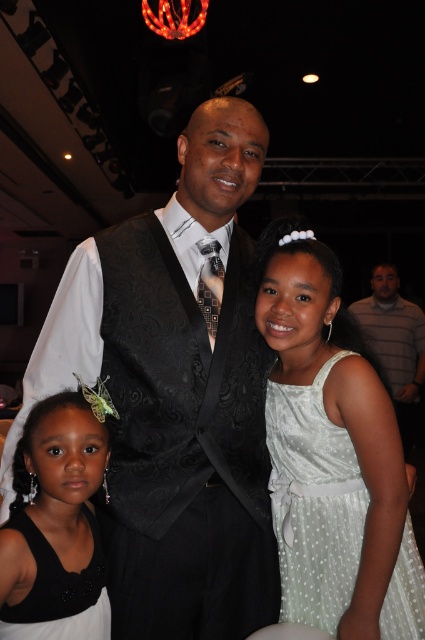
Between black satin dress at lower left and striped cotton shirt at upper right, which one is positioned higher?

black satin dress at lower left is higher up.

You are a GUI agent. You are given a task and a screenshot of the screen. Output one action in this format:
    pyautogui.click(x=<x>, y=<y>)
    Task: Click on the black satin dress at lower left
    This screenshot has height=640, width=425.
    Given the screenshot: What is the action you would take?
    pyautogui.click(x=56, y=528)

Between white dotted fabric dress at center and black satin dress at lower left, which one has more height?

white dotted fabric dress at center

Does point (312, 474) come behind point (54, 624)?

Yes, point (312, 474) is farther from viewer.

Describe the element at coordinates (314, 502) in the screenshot. Image resolution: width=425 pixels, height=640 pixels. I see `white dotted fabric dress at center` at that location.

I want to click on white dotted fabric dress at center, so click(x=314, y=502).

Does white dotted fabric dress at center have a greater height compared to striped cotton shirt at upper right?

In fact, white dotted fabric dress at center may be shorter than striped cotton shirt at upper right.

Which is above, white dotted fabric dress at center or striped cotton shirt at upper right?

Positioned higher is white dotted fabric dress at center.

Is point (325, 467) farther from viewer compared to point (404, 381)?

No.

This screenshot has height=640, width=425. In order to click on white dotted fabric dress at center in this screenshot , I will do `click(314, 502)`.